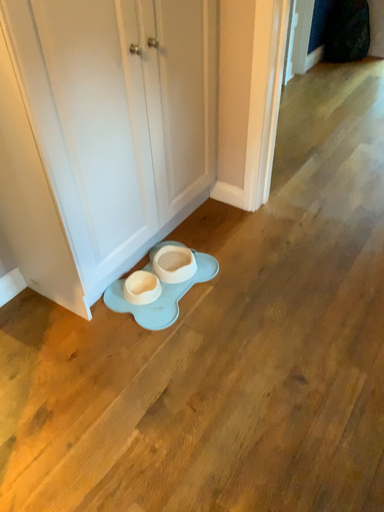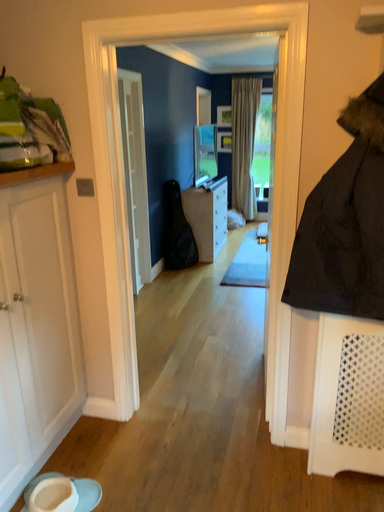
Question: How did the camera likely rotate when shooting the video?

Choices:
 (A) rotated downward
 (B) rotated upward

Answer: (B)